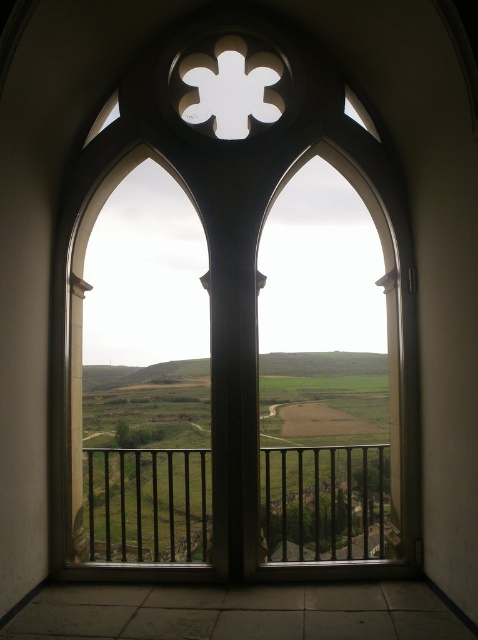
Question: Can you confirm if clear glass window at center is smaller than black metal railing at lower center?

Choices:
 (A) yes
 (B) no

Answer: (B)

Question: Is clear glass window at center bigger than black metal railing at lower center?

Choices:
 (A) no
 (B) yes

Answer: (B)

Question: Which point is farther to the camera?

Choices:
 (A) (398, 486)
 (B) (208, 513)

Answer: (B)

Question: Among these objects, which one is farthest from the camera?

Choices:
 (A) black metal railing at lower center
 (B) clear glass window at center

Answer: (A)

Question: Considering the relative positions of clear glass window at center and black metal railing at lower center in the image provided, where is clear glass window at center located with respect to black metal railing at lower center?

Choices:
 (A) left
 (B) right

Answer: (A)